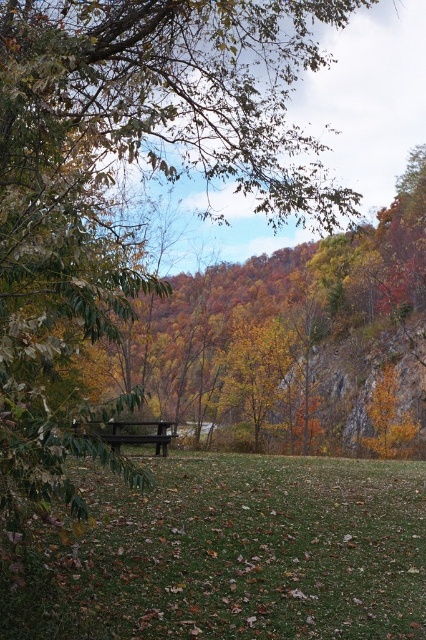
You are planning to set up a small garden in the green grassy field at center and the wooden bench at center. Which area has enough space to accommodate a garden bed that requires 2 square meters of space?

The wooden bench at center is larger than the green grassy field at center, so the wooden bench at center has enough space to accommodate a garden bed that requires 2 square meters of space.

Based on the photo, you are planning to place a 5 feet long picnic blanket on the green grassy field at center. The wooden bench at center is in the way. Can you fit the picnic blanket on the field without overlapping the bench?

The distance between the green grassy field at center and the wooden bench at center is 6.66 feet. Since the picnic blanket is 5 feet long, there is enough space to place it on the green grassy field at center without overlapping the bench.